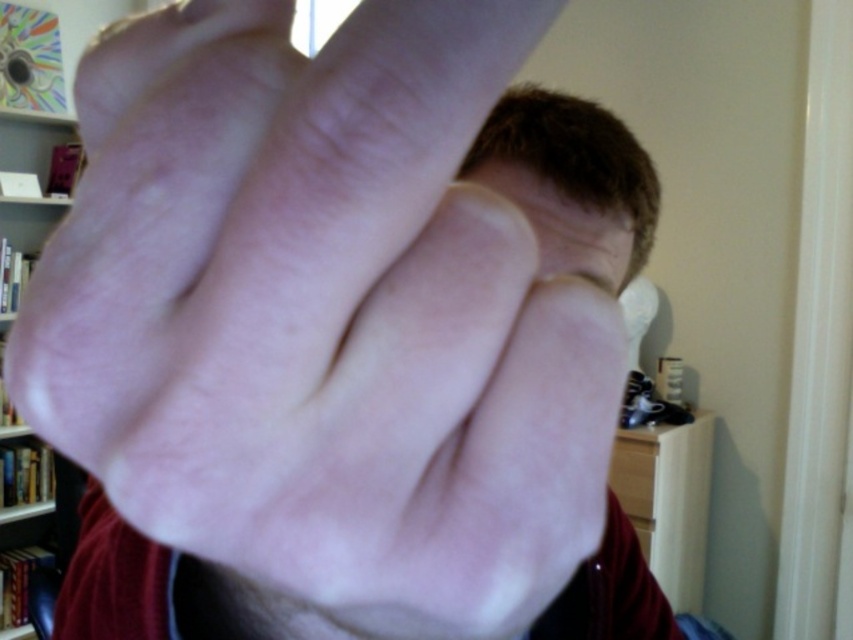
You are an artist trying to sketch the scene. You notice the smooth skin hand at center and the white wooden bookshelf at upper left. Which object should you draw first to ensure proper layering?

You should draw the white wooden bookshelf at upper left first because the smooth skin hand at center is in front of it, so the bookshelf needs to be placed behind the hand in the drawing.

You are an artist trying to sketch the scene. The smooth skin hand at center is at a specific coordinate. Can you determine if it is positioned closer to the top or bottom half of the image?

The smooth skin hand at center is located at point (323, 320), which places it in the bottom half of the image since the y coordinate is less than 0.5.